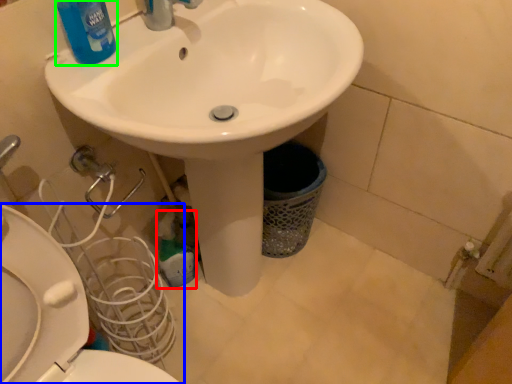
Question: Which object is the closest to the cleaning product (highlighted by a red box)? Choose among these: toilet (highlighted by a blue box) or cleaning product (highlighted by a green box).

Choices:
 (A) toilet
 (B) cleaning product

Answer: (A)